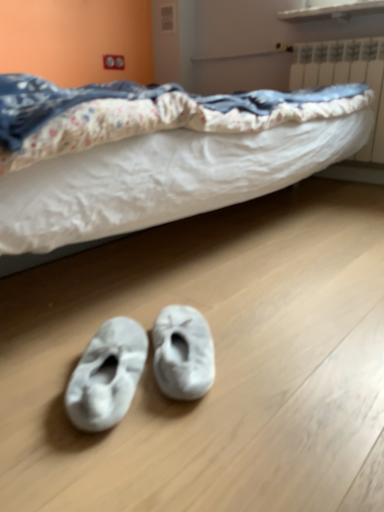
Locate an element on the screen. The width and height of the screenshot is (384, 512). blank space situated above white fuzzy slippers at lower center, which is the second footwear from right to left (from a real-world perspective) is located at coordinates (114, 346).